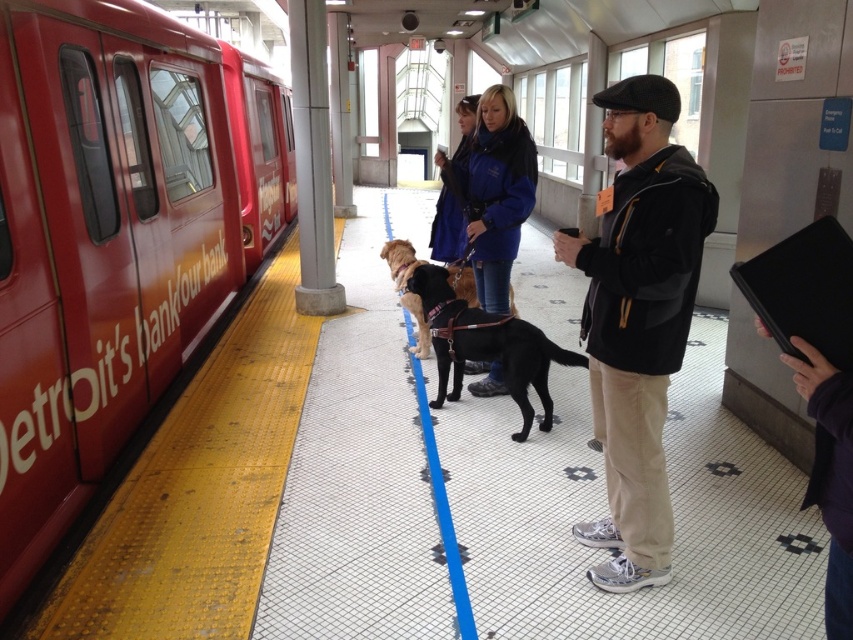
Question: Which point appears closest to the camera in this image?

Choices:
 (A) (840, 534)
 (B) (514, 170)
 (C) (20, 177)
 (D) (421, 268)

Answer: (A)

Question: Which object is positioned farthest from the purple fabric at right?

Choices:
 (A) red matte train at left
 (B) golden fur dog at center
 (C) black leather dog at center

Answer: (A)

Question: Can you confirm if red matte train at left is positioned below black matte jacket at center?

Choices:
 (A) no
 (B) yes

Answer: (A)

Question: Does black matte jacket at center appear on the left side of golden fur dog at center?

Choices:
 (A) yes
 (B) no

Answer: (B)

Question: Does black leather dog at center appear under golden fur dog at center?

Choices:
 (A) no
 (B) yes

Answer: (B)

Question: Which object appears closest to the camera in this image?

Choices:
 (A) purple fabric at right
 (B) black leather dog at center

Answer: (A)